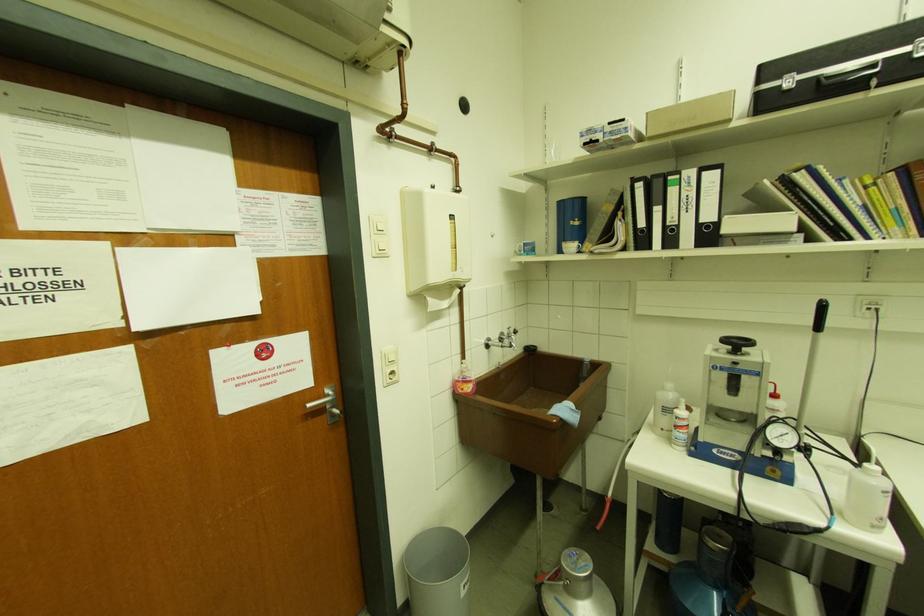
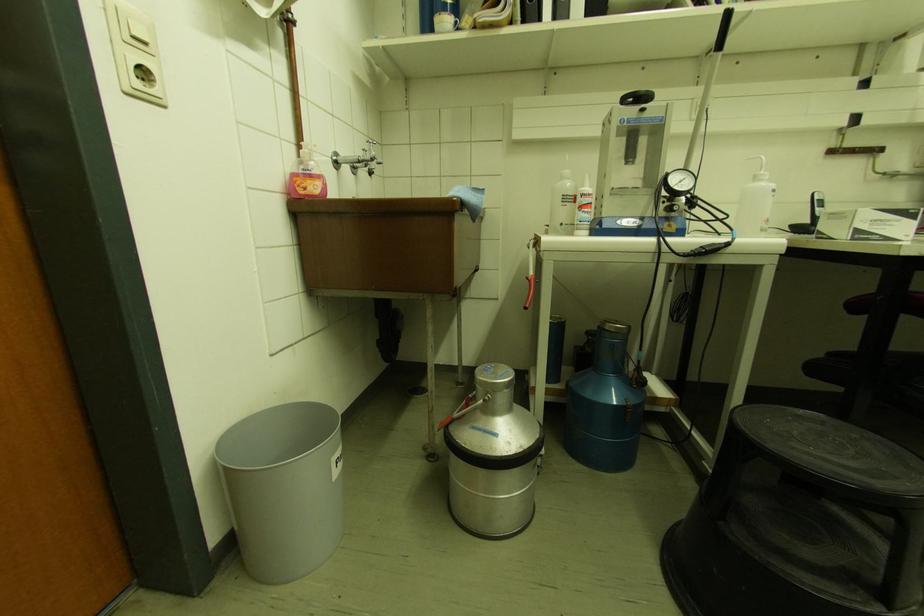
Question: Which direction would the cameraman need to move to produce the second image? Reply with the corresponding letter.

Choices:
 (A) Left
 (B) Right
 (C) Forward
 (D) Backward

Answer: (C)